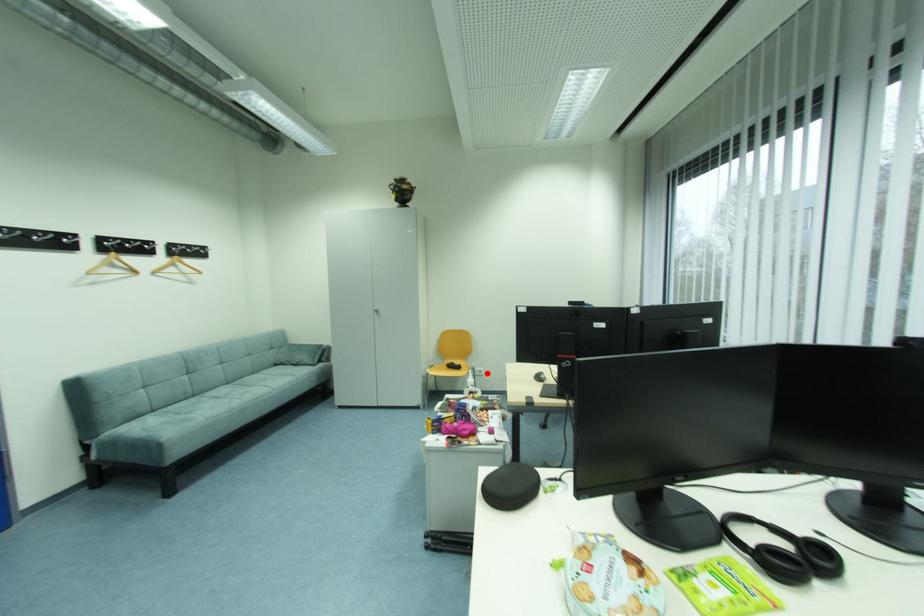
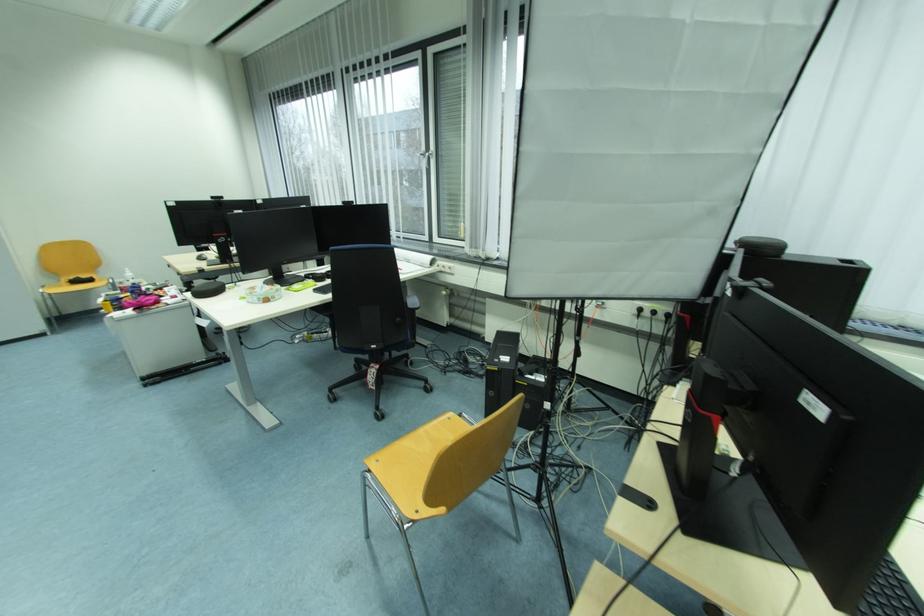
Where in the second image is the point corresponding to the highlighted location from the first image?

(128, 284)